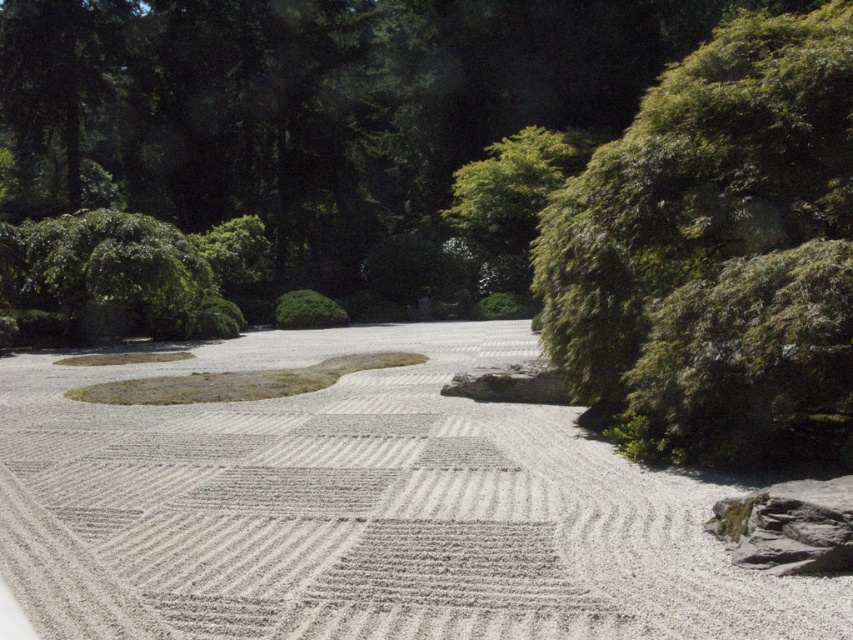
Question: Which point is closer to the camera taking this photo?

Choices:
 (A) (798, 497)
 (B) (796, 321)
 (C) (103, 595)

Answer: (C)

Question: Which point appears farthest from the camera in this image?

Choices:
 (A) (786, 486)
 (B) (804, 202)
 (C) (456, 380)

Answer: (C)

Question: Does white textured gravel at center appear on the right side of gray rough rock at lower right?

Choices:
 (A) no
 (B) yes

Answer: (A)

Question: Where is green leafy bush at upper right located in relation to gray rough rock at lower right in the image?

Choices:
 (A) above
 (B) below

Answer: (A)

Question: Does green leafy bush at upper right appear under smooth gray rock at center?

Choices:
 (A) yes
 (B) no

Answer: (B)

Question: Which point is farther from the camera taking this photo?

Choices:
 (A) (524, 362)
 (B) (834, 561)
 (C) (558, 276)

Answer: (A)